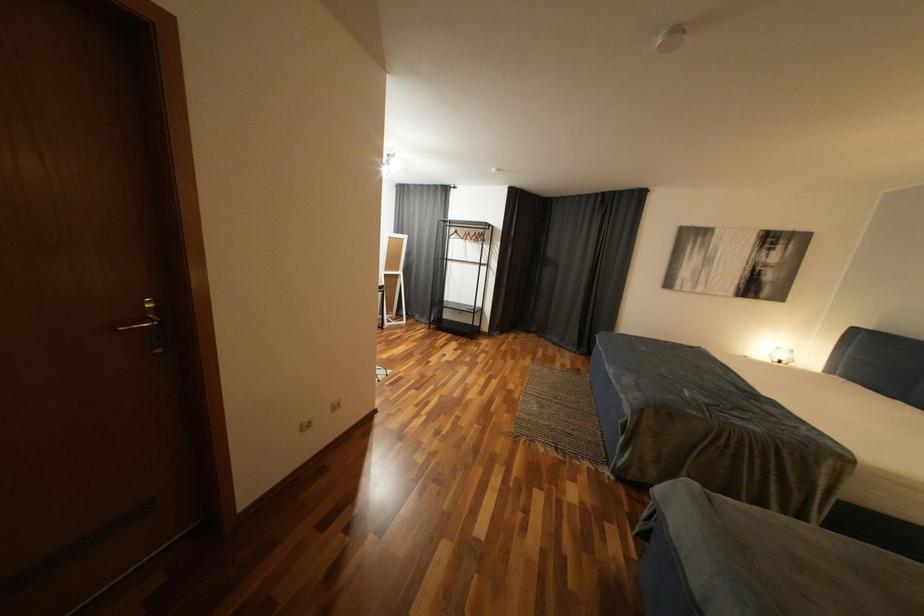
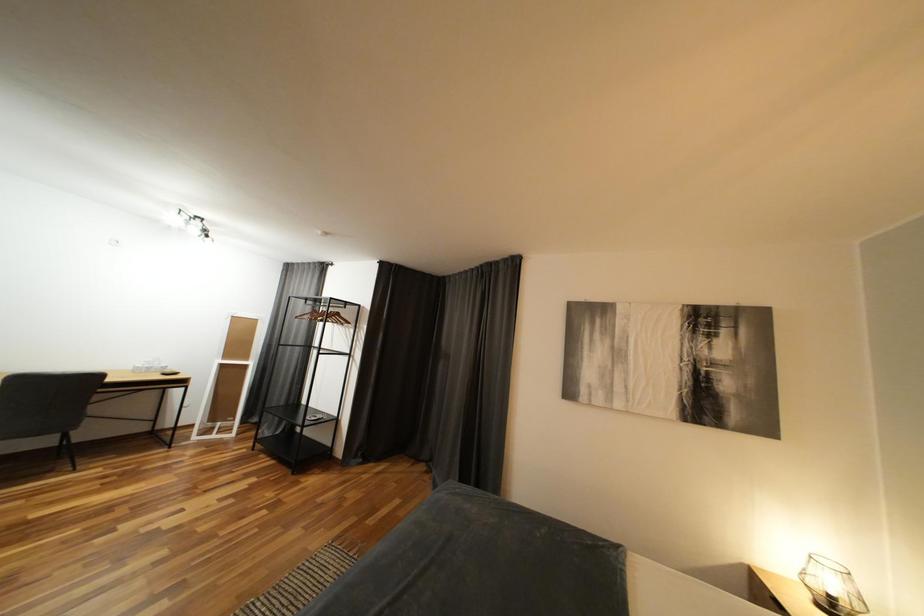
Which direction would the cameraman need to move to produce the second image?

The cameraman moved toward right, forward.